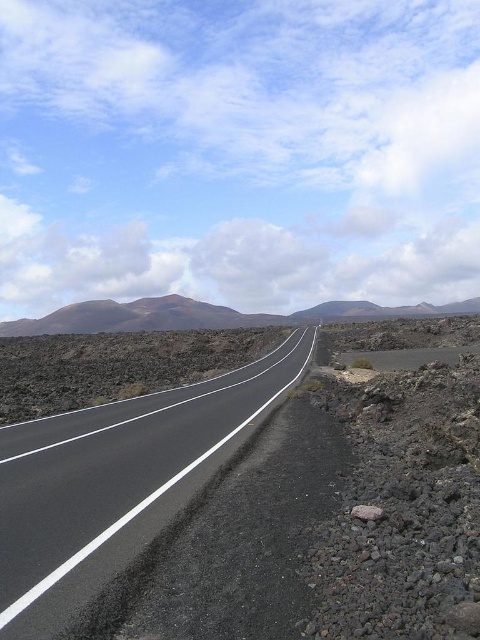
Question: Which object appears farthest from the camera in this image?

Choices:
 (A) brown volcanic rock at center
 (B) black asphalt highway at center

Answer: (A)

Question: Is black asphalt highway at center positioned before brown volcanic rock at center?

Choices:
 (A) yes
 (B) no

Answer: (A)

Question: Can you confirm if black asphalt highway at center is wider than brown volcanic rock at center?

Choices:
 (A) no
 (B) yes

Answer: (A)

Question: Which point is closer to the camera?

Choices:
 (A) black asphalt highway at center
 (B) brown volcanic rock at center

Answer: (A)

Question: Does black asphalt highway at center have a larger size compared to brown volcanic rock at center?

Choices:
 (A) no
 (B) yes

Answer: (A)